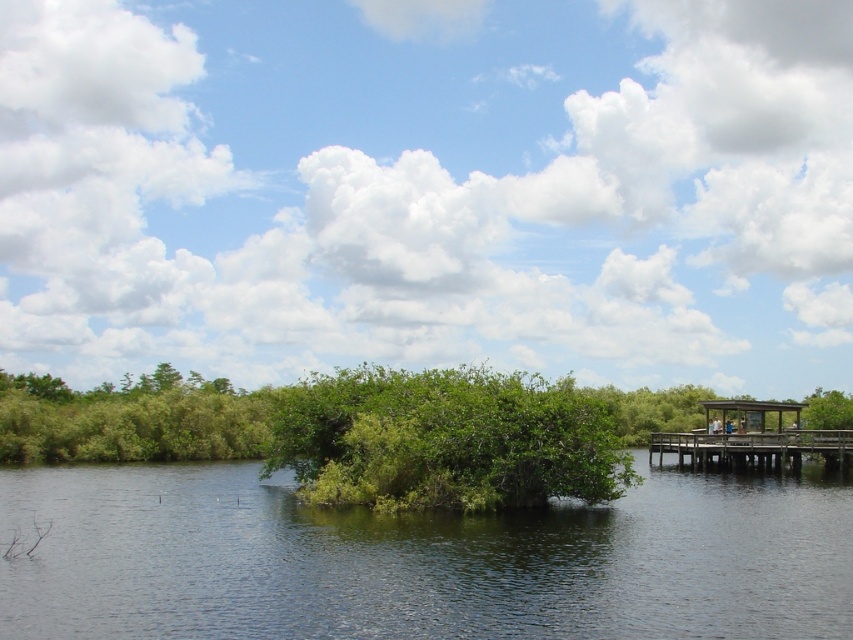
Question: Which object is positioned farthest from the green leafy river at center?

Choices:
 (A) brown wooden dock at right
 (B) green leafy bush at center

Answer: (A)

Question: Can you confirm if green leafy river at center is thinner than brown wooden dock at right?

Choices:
 (A) no
 (B) yes

Answer: (A)

Question: Considering the relative positions of green leafy river at center and green leafy bush at center in the image provided, where is green leafy river at center located with respect to green leafy bush at center?

Choices:
 (A) above
 (B) below

Answer: (B)

Question: Which point is farther from the camera taking this photo?

Choices:
 (A) (849, 461)
 (B) (514, 476)

Answer: (A)

Question: Does green leafy river at center appear on the right side of green leafy bush at center?

Choices:
 (A) no
 (B) yes

Answer: (A)

Question: Which object is closer to the camera taking this photo?

Choices:
 (A) green leafy river at center
 (B) brown wooden dock at right
 (C) green leafy bush at center

Answer: (A)